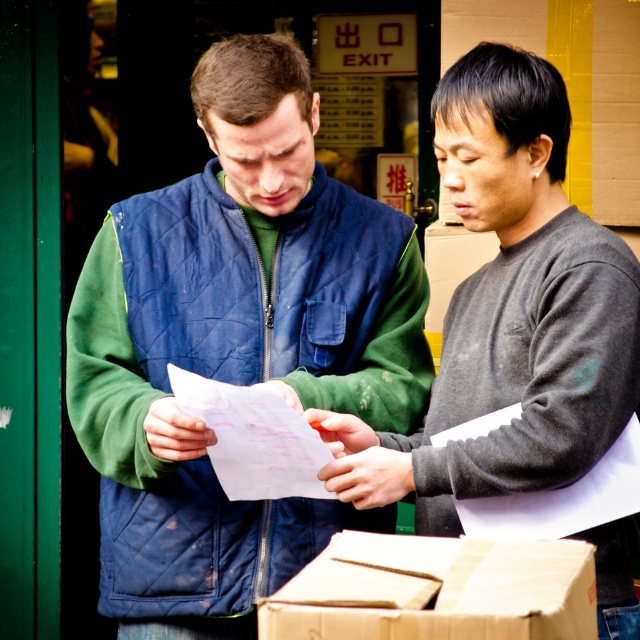
You are a delivery person who needs to place a small package between the gray matte sweater at center and the white paper at center. Based on their positions and sizes, can you fit the package there?

The gray matte sweater at center might be wider than white paper at center, so there might not be enough space to fit the package between them. You should check the exact dimensions before deciding.

You are standing at the point marked as point (166, 324) and want to walk to the point marked as point (269, 422). Which direction should you move in to reach your destination?

To reach point (269, 422) from point (166, 324), you should move forward because point (166, 324) is behind point (269, 422).

You are a delivery person who needs to deliver a package to the gray matte sweater at center. The delivery requires you to approach within 1 meter. Given that you are currently at point (509,310), can you safely make the delivery?

Yes, because the gray matte sweater at center is exactly at the point (509,310) where you are currently located, so you are already within the required 1 meter distance for delivery.